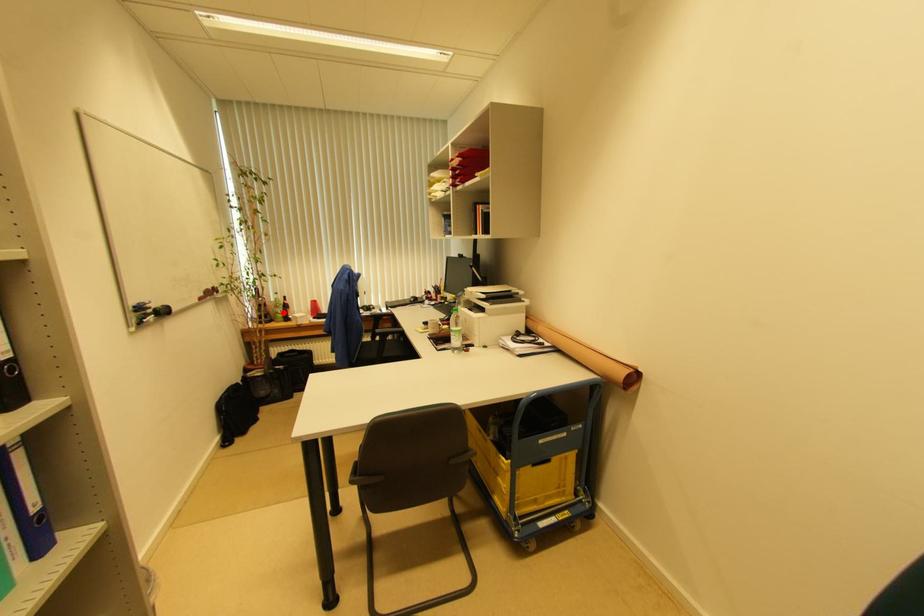
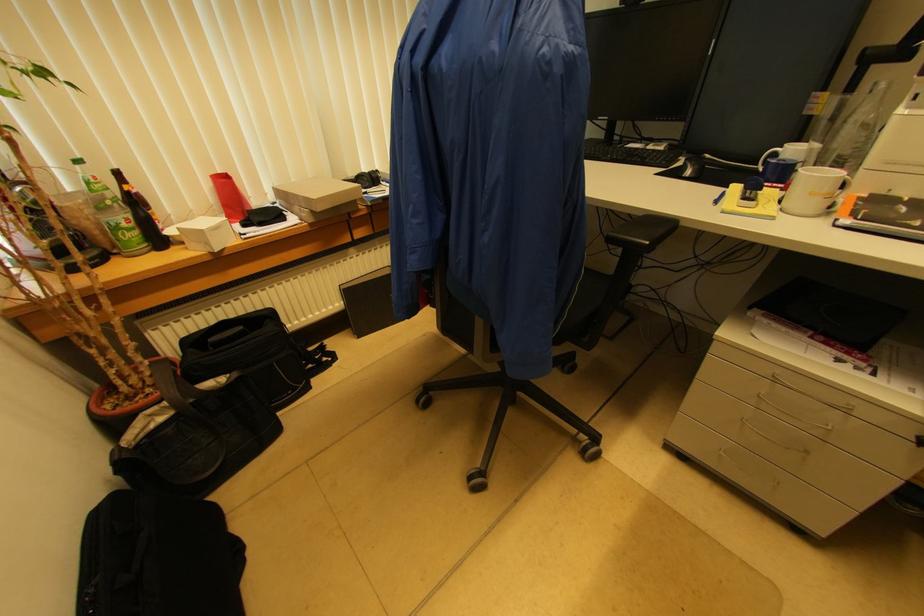
Question: I am providing you with two images of the same scene from different viewpoints. Image1 has a red point marked. In image2, the corresponding 3D location appears at what relative position? Reply with the corresponding letter.

Choices:
 (A) Closer
 (B) Farther

Answer: (B)